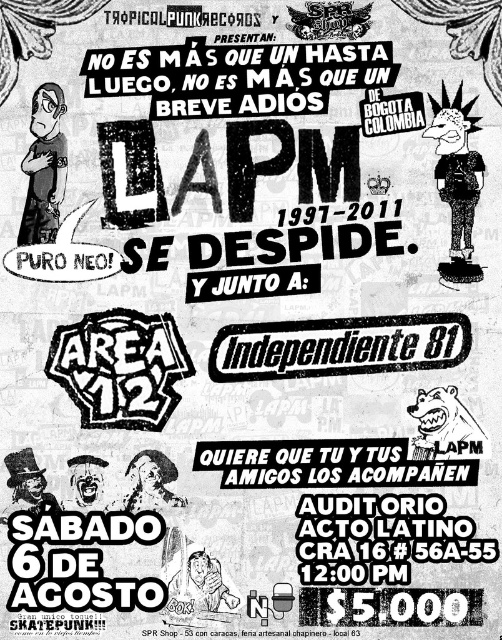
What is the relationship between the black textured sticker at center and the black bear at lower right in terms of their positioning on the poster?

The black textured sticker at center is positioned closer to the viewer than the black bear at lower right, creating a layered visual effect.

What is the relationship between the size of the black textured sticker at center and the black bear at lower right?

The black textured sticker at center has a smaller size compared to the black bear at lower right.